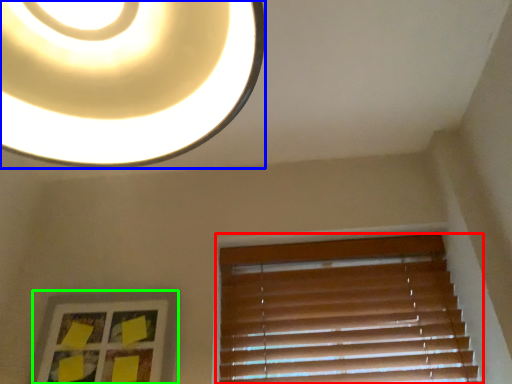
Question: Which object is positioned farthest from window blind (highlighted by a red box)? Select from lamp (highlighted by a blue box) and picture frame (highlighted by a green box).

Choices:
 (A) lamp
 (B) picture frame

Answer: (A)